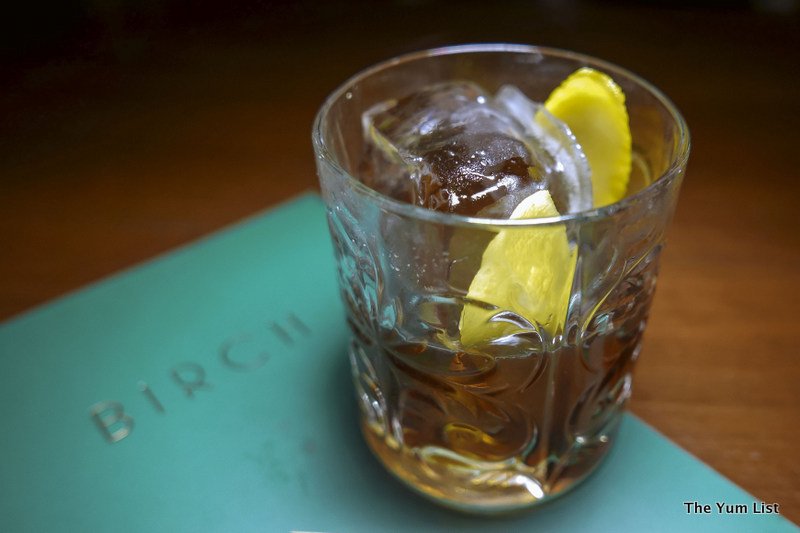
Identify the location of glass. (442, 314).